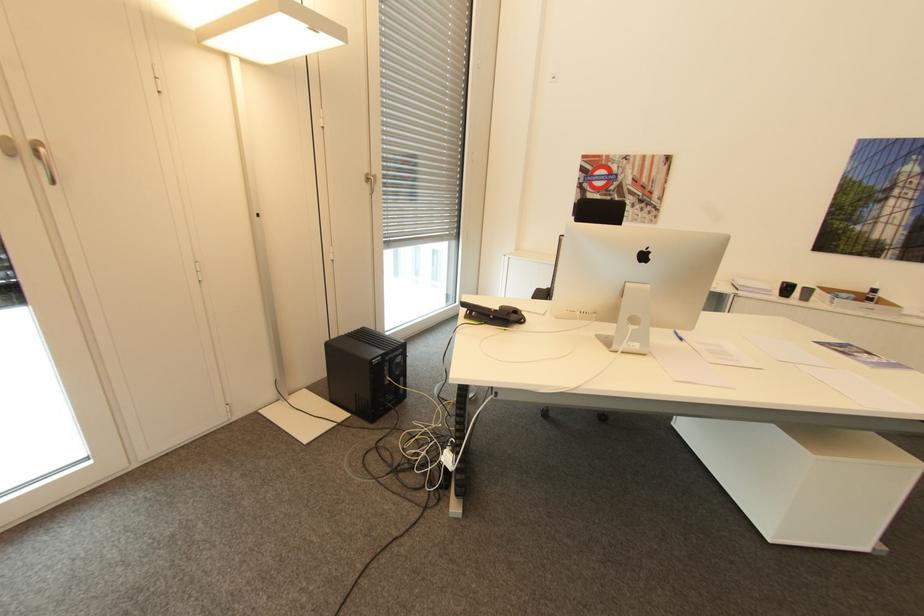
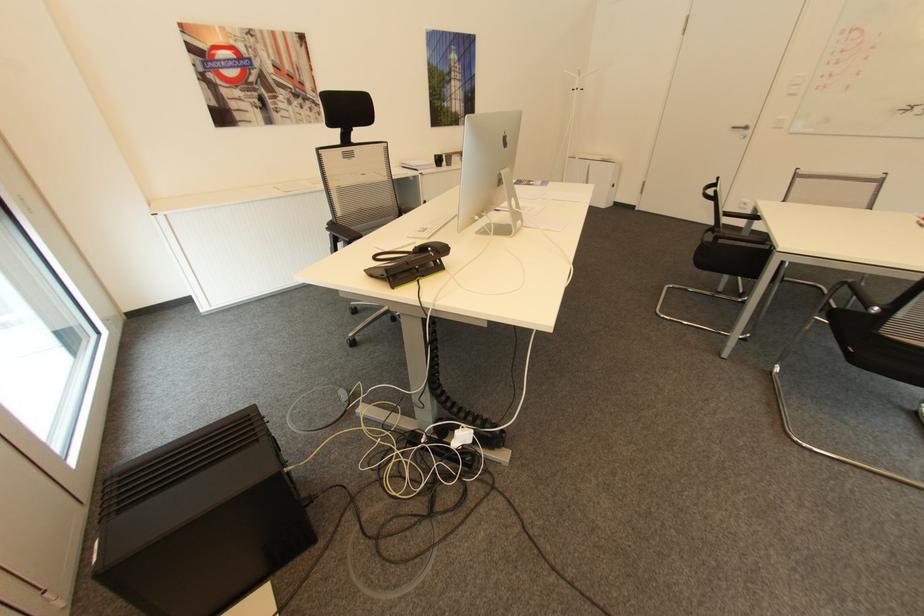
Find the pixel in the second image that matches (x=788, y=283) in the first image.

(441, 155)